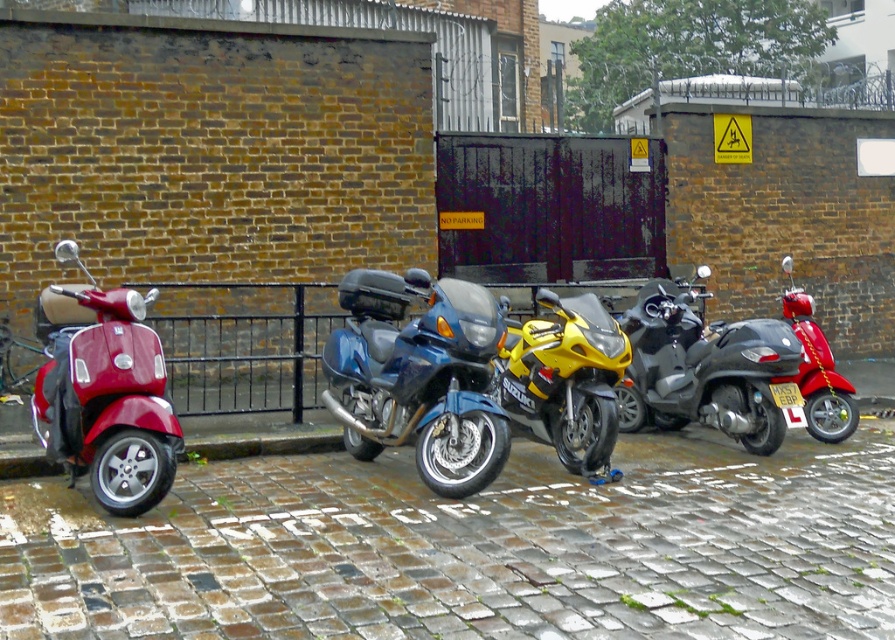
Can you confirm if shiny black scooter at center is positioned to the left of shiny red scooter at right?

Correct, you'll find shiny black scooter at center to the left of shiny red scooter at right.

Is shiny black scooter at center below shiny red scooter at right?

Yes.

Image resolution: width=895 pixels, height=640 pixels. What are the coordinates of `shiny black scooter at center` in the screenshot? It's located at (708, 371).

Can you confirm if blue metallic motorcycle at center is smaller than yellow metallic motorcycle at center?

No.

Is point (416, 284) farther from camera compared to point (587, 458)?

That is False.

The width and height of the screenshot is (895, 640). In order to click on blue metallic motorcycle at center in this screenshot , I will do `click(419, 376)`.

Can you confirm if shiny red scooter at left is smaller than shiny black scooter at center?

Yes, shiny red scooter at left is smaller than shiny black scooter at center.

Is the position of shiny red scooter at left more distant than that of shiny black scooter at center?

No.

Does point (151, 356) lie in front of point (746, 384)?

Yes, point (151, 356) is closer to viewer.

You are a GUI agent. You are given a task and a screenshot of the screen. Output one action in this format:
    pyautogui.click(x=<x>, y=<y>)
    Task: Click on the shiny red scooter at left
    The image size is (895, 640).
    Given the screenshot: What is the action you would take?
    pyautogui.click(x=105, y=394)